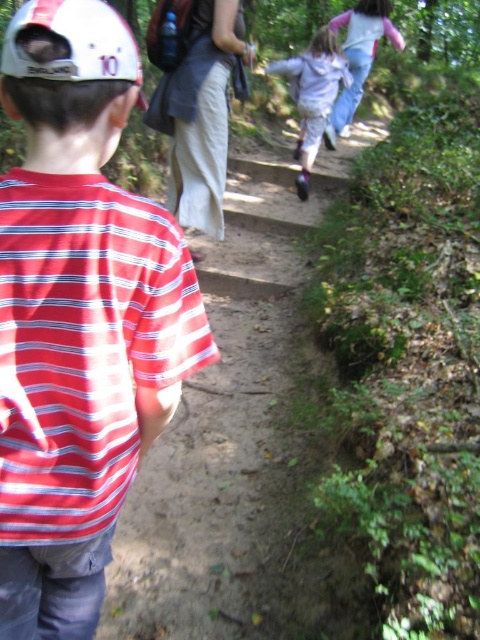
I want to click on white matte baseball cap at upper left, so click(x=74, y=42).

Is point (8, 28) positioned after point (356, 108)?

That is False.

Image resolution: width=480 pixels, height=640 pixels. I want to click on white matte baseball cap at upper left, so (x=74, y=42).

Between point (253, 484) and point (336, 20), which one is positioned behind?

Point (336, 20)

Can you confirm if dirt path at center is thinner than light blue jeans at upper center?

Correct, dirt path at center's width is less than light blue jeans at upper center's.

Between point (121, 604) and point (377, 1), which one is positioned in front?

Point (121, 604)

Locate an element on the screen. dirt path at center is located at coordinates (231, 426).

Does point (90, 122) come behind point (88, 74)?

That is True.

From the picture: Measure the distance between striped cotton shirt at center and camera.

striped cotton shirt at center and camera are 67.44 centimeters apart from each other.

This screenshot has height=640, width=480. What are the coordinates of `striped cotton shirt at center` in the screenshot? It's located at (79, 316).